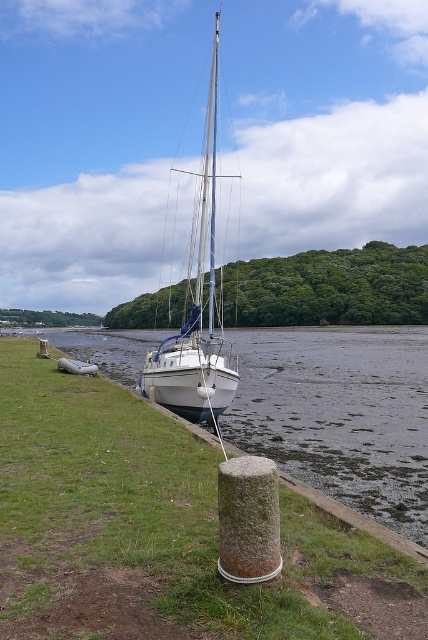
Which is more to the left, green grass at lower left or green mossy stone pillar at lower center?

green grass at lower left

Is green grass at lower left bigger than green mossy stone pillar at lower center?

Yes.

Where is `green grass at lower left`? The height and width of the screenshot is (640, 428). green grass at lower left is located at coordinates (160, 531).

Where is `green grass at lower left`? Image resolution: width=428 pixels, height=640 pixels. green grass at lower left is located at coordinates (160, 531).

Looking at this image, how much distance is there between white glossy sailboat at center and green mossy stone pillar at lower center?

white glossy sailboat at center and green mossy stone pillar at lower center are 30.39 meters apart from each other.

Does white glossy sailboat at center have a larger size compared to green mossy stone pillar at lower center?

Yes, white glossy sailboat at center is bigger than green mossy stone pillar at lower center.

At what (x,y) coordinates should I click in order to perform the action: click on white glossy sailboat at center. Please return your answer as a coordinate pair (x, y). Looking at the image, I should click on (196, 307).

Is green grass at lower left taller than white glossy sailboat at center?

No, green grass at lower left is not taller than white glossy sailboat at center.

The width and height of the screenshot is (428, 640). Find the location of `green grass at lower left`. green grass at lower left is located at coordinates 160,531.